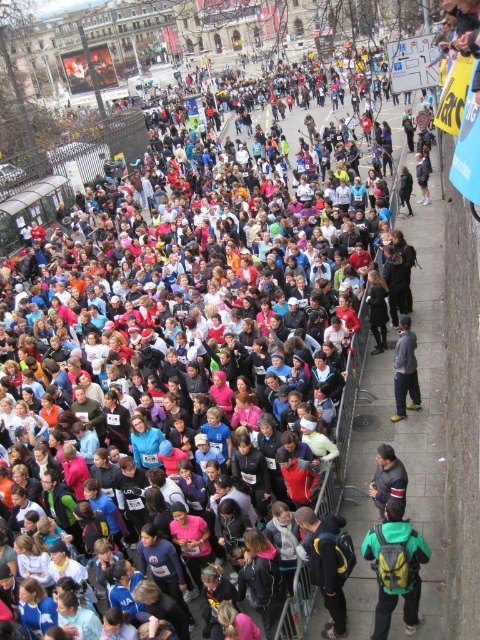
Consider the image. Can you confirm if green/yellow backpack at center is wider than dark gray sweater at lower right?

Yes, green/yellow backpack at center is wider than dark gray sweater at lower right.

Can you confirm if green/yellow backpack at center is positioned to the left of dark gray sweater at lower right?

Indeed, green/yellow backpack at center is positioned on the left side of dark gray sweater at lower right.

Identify the location of green/yellow backpack at center. (396, 566).

Can you confirm if dark blue jacket at center is positioned to the right of dark gray sweater at lower right?

Incorrect, dark blue jacket at center is not on the right side of dark gray sweater at lower right.

What do you see at coordinates (327, 563) in the screenshot?
I see `dark blue jacket at center` at bounding box center [327, 563].

Which is behind, point (336, 620) or point (397, 481)?

Positioned behind is point (397, 481).

Locate an element on the screen. dark blue jacket at center is located at coordinates (327, 563).

Can you confirm if gray fabric jacket at center is positioned below dark gray sweater at lower right?

No.

Is gray fabric jacket at center taller than dark gray sweater at lower right?

No, gray fabric jacket at center is not taller than dark gray sweater at lower right.

Is point (402, 349) closer to camera compared to point (384, 458)?

That is False.

This screenshot has width=480, height=640. I want to click on gray fabric jacket at center, so pyautogui.click(x=405, y=371).